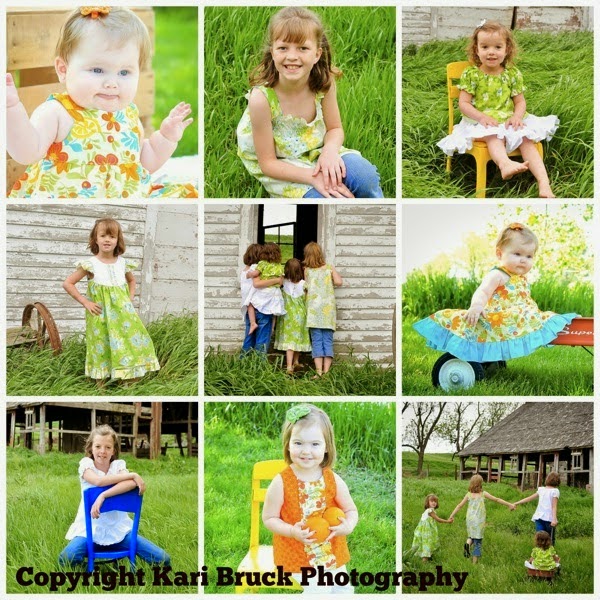
This screenshot has width=600, height=600. Find the location of `photos in collage`. photos in collage is located at coordinates (122, 108), (354, 44), (478, 72), (476, 218), (347, 249), (187, 253), (163, 455), (332, 451), (447, 435).